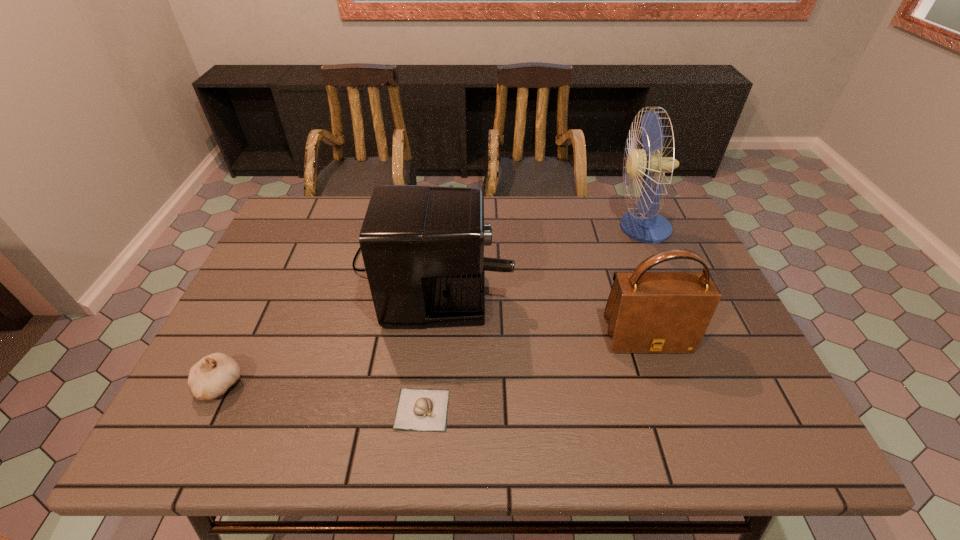
This screenshot has height=540, width=960. In order to click on free space between the coffee maker and the tallest object in this screenshot , I will do `click(537, 244)`.

Identify the location of vacant space that is in between the shoulder bag and the shortest object. (535, 374).

Locate an element on the screen. This screenshot has width=960, height=540. blank region between the coffee maker and the right garlic is located at coordinates (427, 335).

This screenshot has height=540, width=960. Find the location of `empty location between the coffee maker and the tallest object`. empty location between the coffee maker and the tallest object is located at coordinates (537, 244).

Where is `free space between the shoulder bag and the left garlic`? The width and height of the screenshot is (960, 540). free space between the shoulder bag and the left garlic is located at coordinates (433, 361).

This screenshot has height=540, width=960. Identify the location of free space between the left garlic and the right garlic. (322, 397).

Locate an element on the screen. Image resolution: width=960 pixels, height=540 pixels. free space between the shortest object and the shoulder bag is located at coordinates (535, 374).

Identify which object is the second nearest to the fan. Please provide its 2D coordinates. Your answer should be formatted as a tuple, i.e. [(x, y)], where the tuple contains the x and y coordinates of a point satisfying the conditions above.

[(423, 246)]

Identify which object is the fourth nearest to the leftmost object. Please provide its 2D coordinates. Your answer should be formatted as a tuple, i.e. [(x, y)], where the tuple contains the x and y coordinates of a point satisfying the conditions above.

[(644, 225)]

At what (x,y) coordinates should I click in order to perform the action: click on vacant space that satisfies the following two spatial constraints: 1. on the front-facing side of the coffee maker; 2. on the left side of the right garlic. Please return your answer as a coordinate pair (x, y). The height and width of the screenshot is (540, 960). Looking at the image, I should click on (415, 409).